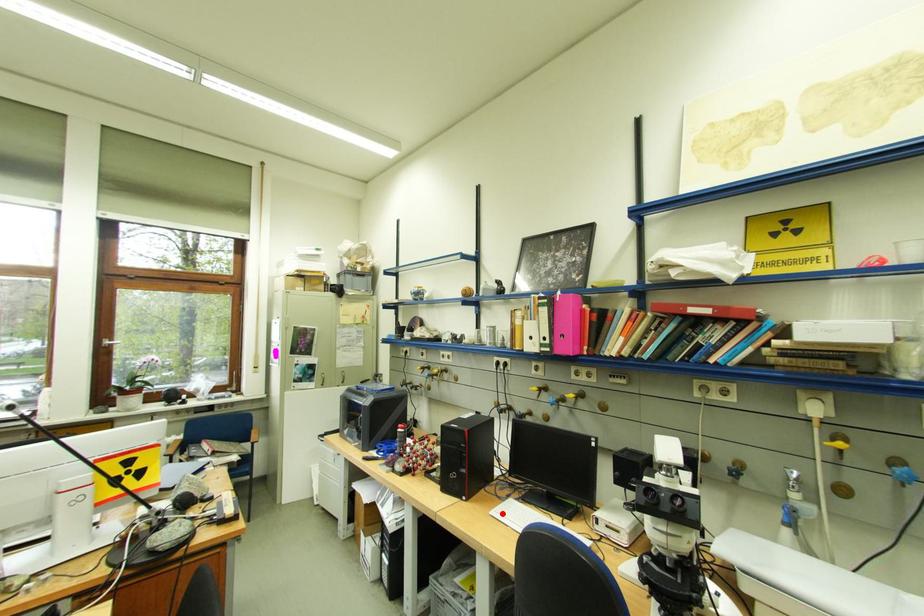
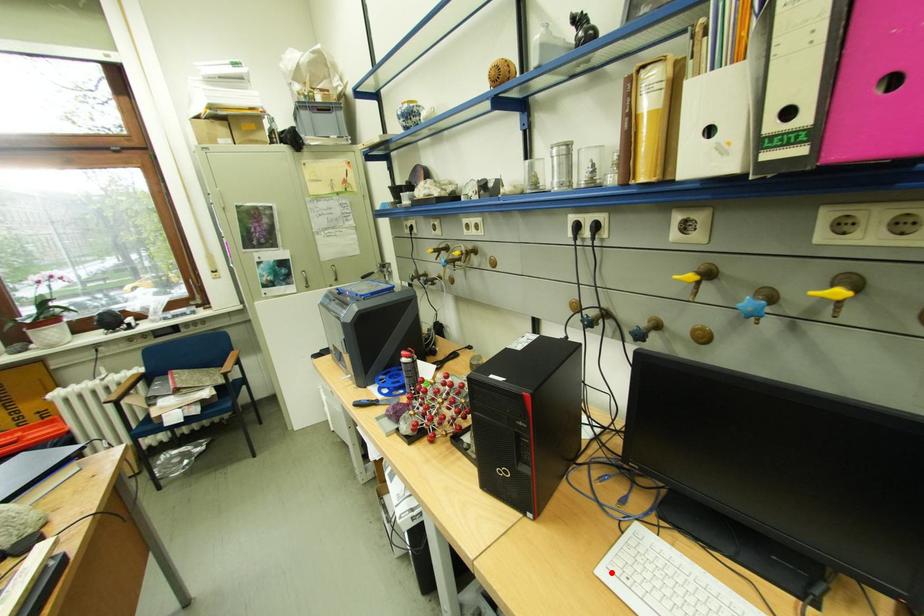
I am providing you with two images of the same scene from different viewpoints. A red point is marked on the first image and another point is marked on the second image. Do the highlighted points in image1 and image2 indicate the same real-world spot?

Yes